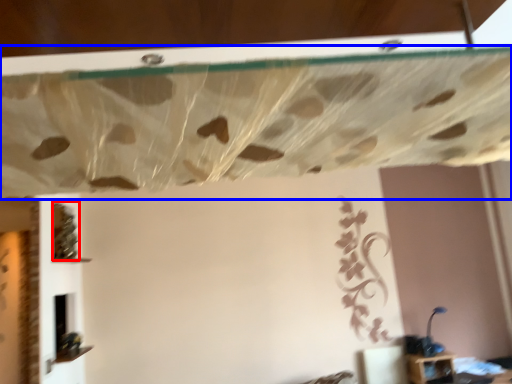
Question: Which point is closer to the camera, vine (highlighted by a red box) or curtain (highlighted by a blue box)?

Choices:
 (A) vine
 (B) curtain

Answer: (B)